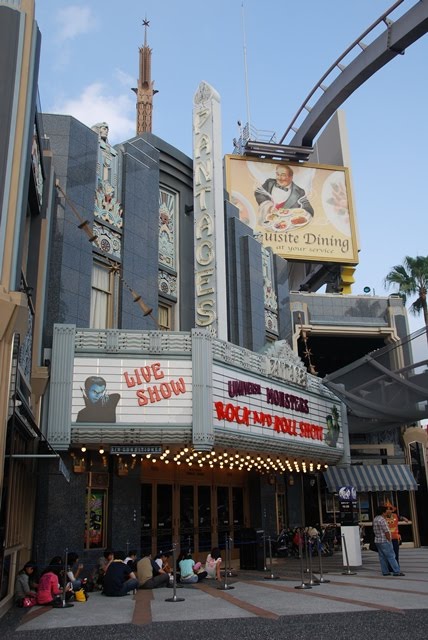
I want to click on grey tiles, so click(x=280, y=605), click(x=206, y=604), click(x=104, y=607).